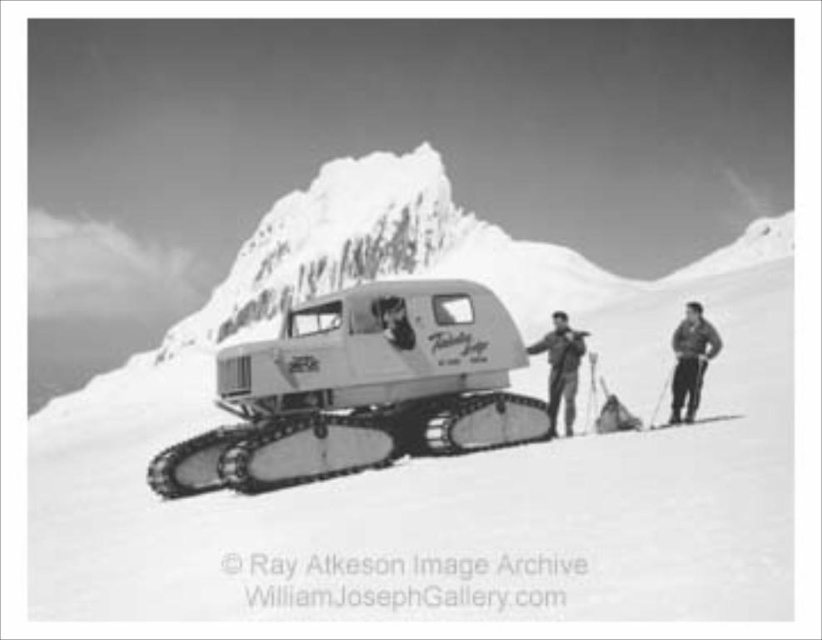
Based on the scene described, which clothing item is taller between the dark gray fabric jacket at right and the smooth fur coat at center?

The dark gray fabric jacket at right is much taller than the smooth fur coat at center.